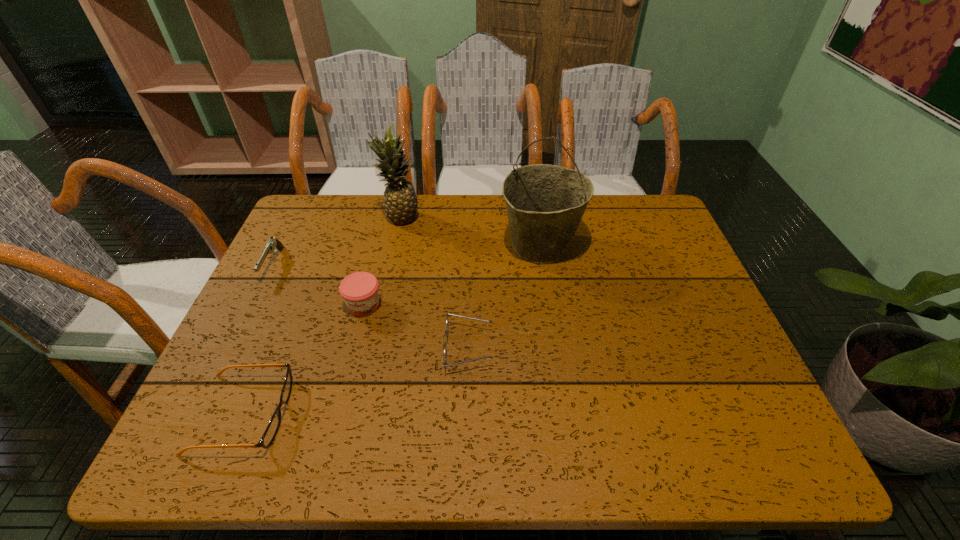
Locate an element on the screen. free location located on the front-facing side of the pistol is located at coordinates (206, 400).

Locate an element on the screen. free space located on the front-facing side of the second object from right to left is located at coordinates (586, 348).

I want to click on vacant space located on the front-facing side of the left spectacles, so click(x=468, y=414).

Where is `wine bucket at the far edge`? wine bucket at the far edge is located at coordinates (545, 203).

Identify the location of pineapple situated at the far edge. click(400, 201).

You are a GUI agent. You are given a task and a screenshot of the screen. Output one action in this format:
    pyautogui.click(x=<x>, y=<y>)
    Task: Click on the object located in the near edge section of the desktop
    This screenshot has width=960, height=540.
    Given the screenshot: What is the action you would take?
    pyautogui.click(x=274, y=424)

Where is `pistol that is at the left edge`? This screenshot has height=540, width=960. pistol that is at the left edge is located at coordinates (273, 244).

I want to click on spectacles situated at the left edge, so click(x=274, y=424).

The image size is (960, 540). Identify the location of object that is at the near left corner. (274, 424).

What are the coordinates of `vacant space at the far edge` in the screenshot? It's located at (402, 226).